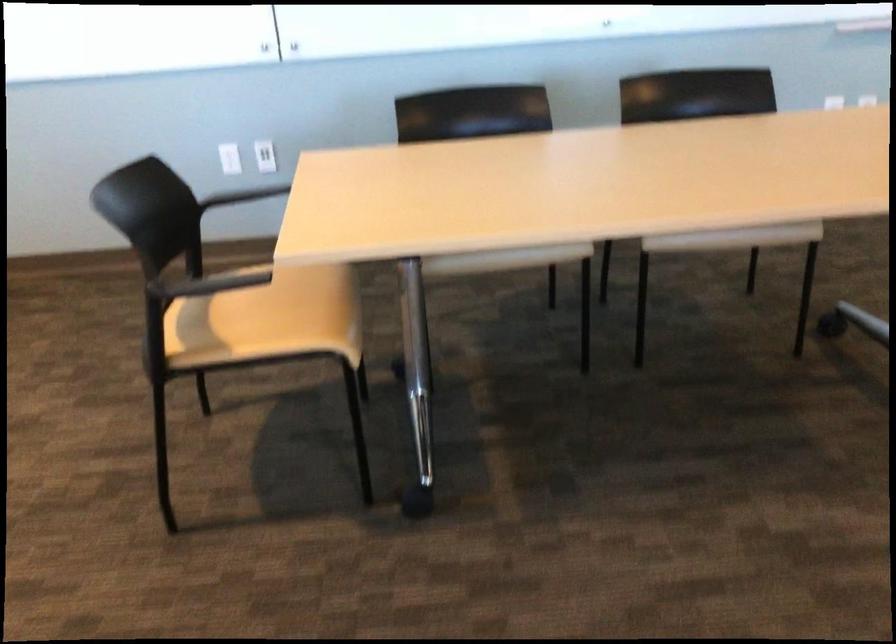
This screenshot has width=896, height=644. I want to click on tan chair sitting surface, so 274,315.